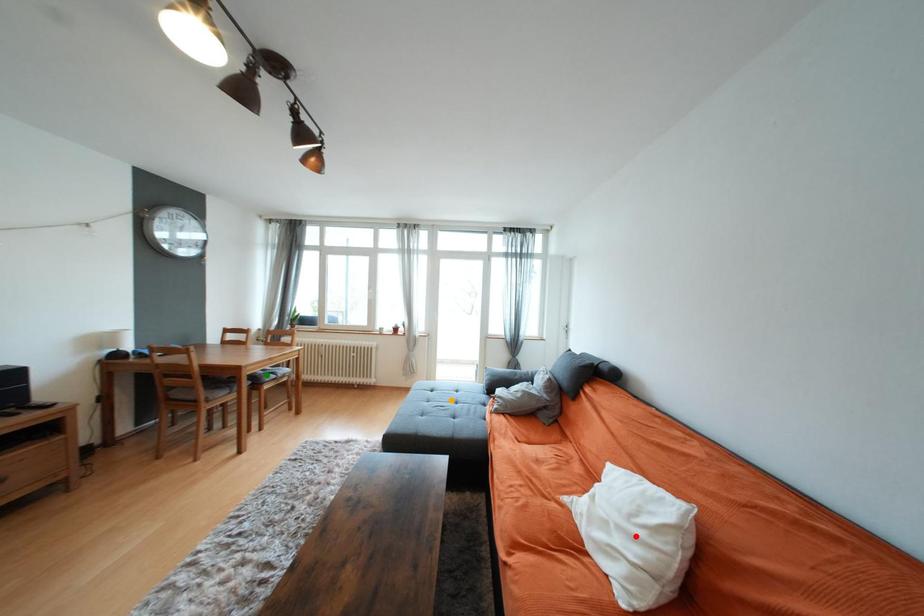
Order these from nearest to farthest:
orange point
red point
green point

green point → orange point → red point